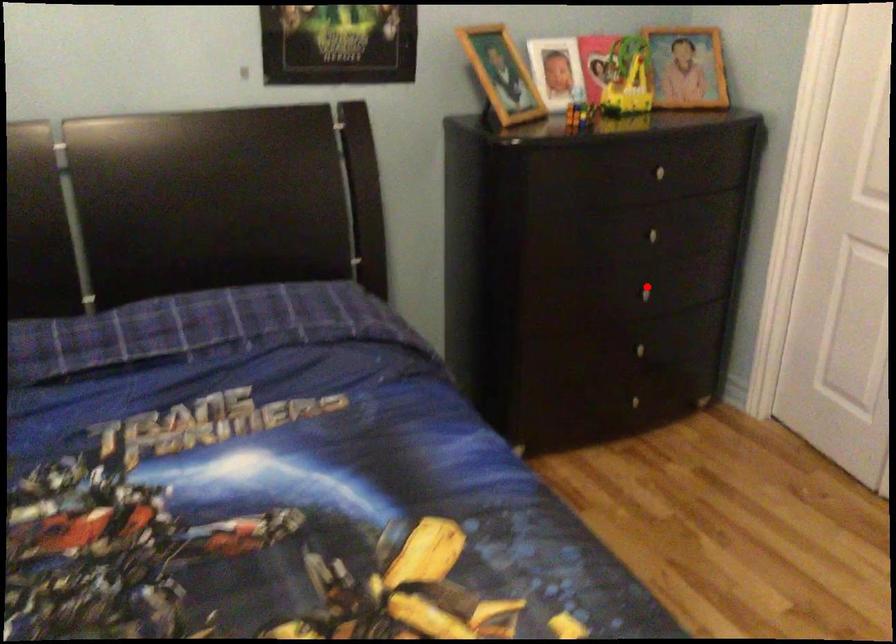
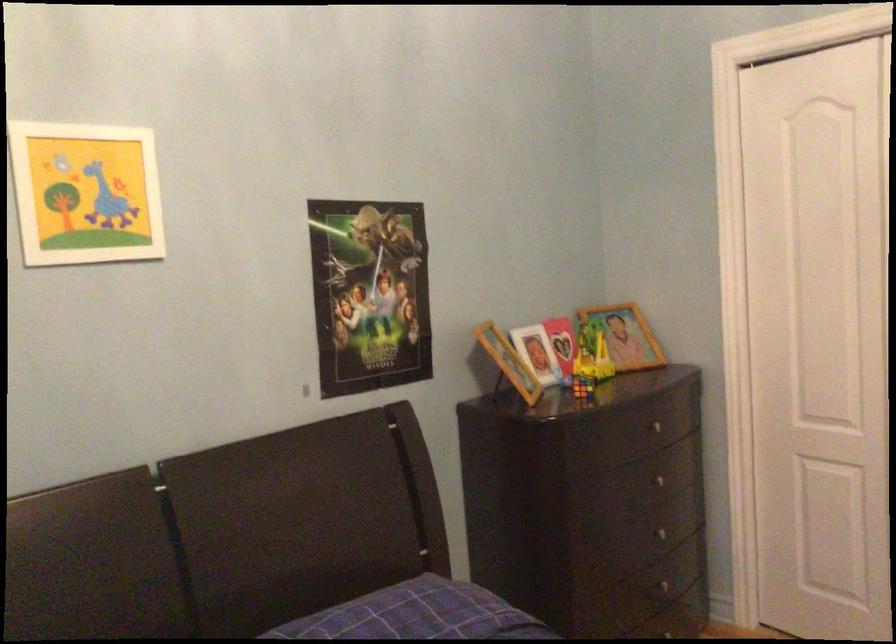
Locate, in the second image, the point that corresponds to the highlighted location in the first image.

(667, 532)